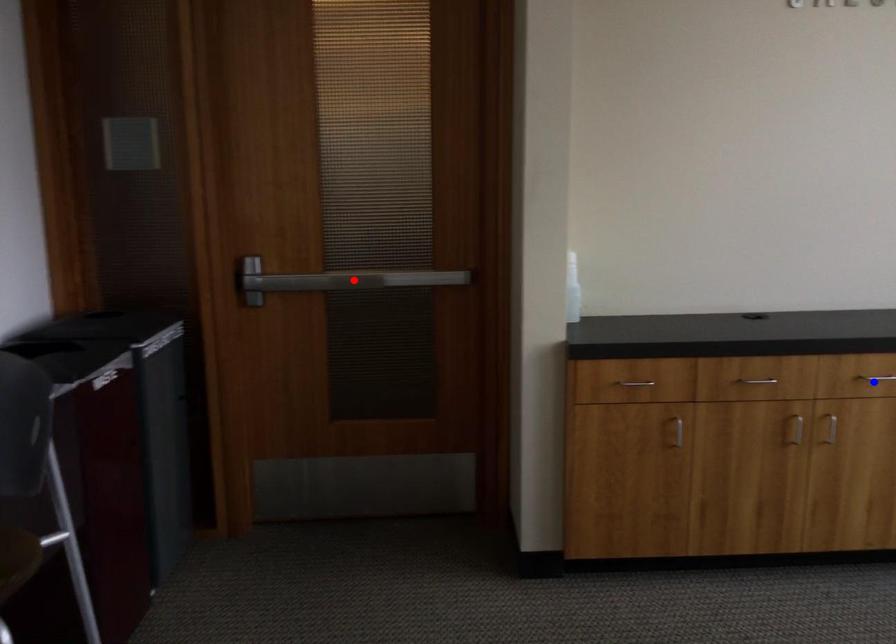
Question: In the image, two points are highlighted. Which point is nearer to the camera? Reply with the corresponding letter.

Choices:
 (A) blue point
 (B) red point

Answer: (A)